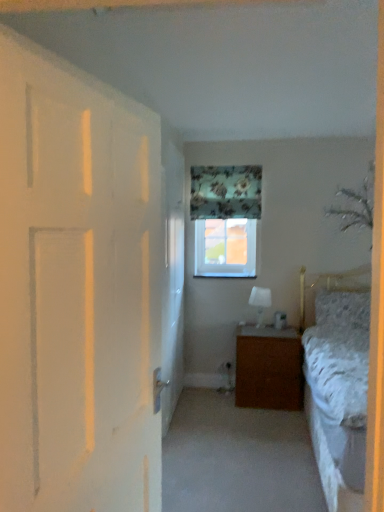
Question: Can you confirm if clear glass window at upper center is bigger than fluffy white pillow at right?

Choices:
 (A) yes
 (B) no

Answer: (B)

Question: Are clear glass window at upper center and fluffy white pillow at right located far from each other?

Choices:
 (A) yes
 (B) no

Answer: (B)

Question: Does clear glass window at upper center have a smaller size compared to fluffy white pillow at right?

Choices:
 (A) no
 (B) yes

Answer: (B)

Question: Is clear glass window at upper center not inside fluffy white pillow at right?

Choices:
 (A) yes
 (B) no

Answer: (A)

Question: Can you confirm if clear glass window at upper center is taller than fluffy white pillow at right?

Choices:
 (A) yes
 (B) no

Answer: (A)

Question: Relative to fluffy white pillow at right, is floral fabric curtain at upper center in front or behind?

Choices:
 (A) behind
 (B) front

Answer: (A)

Question: Considering the positions of floral fabric curtain at upper center and fluffy white pillow at right in the image, is floral fabric curtain at upper center bigger or smaller than fluffy white pillow at right?

Choices:
 (A) big
 (B) small

Answer: (B)

Question: Choose the correct answer: Is floral fabric curtain at upper center inside fluffy white pillow at right or outside it?

Choices:
 (A) inside
 (B) outside

Answer: (B)

Question: From their relative heights in the image, would you say floral fabric curtain at upper center is taller or shorter than fluffy white pillow at right?

Choices:
 (A) short
 (B) tall

Answer: (B)

Question: Considering the positions of white glossy screen door at center and fluffy white pillow at right in the image, is white glossy screen door at center taller or shorter than fluffy white pillow at right?

Choices:
 (A) tall
 (B) short

Answer: (A)

Question: From a real-world perspective, relative to fluffy white pillow at right, is white glossy screen door at center vertically above or below?

Choices:
 (A) below
 (B) above

Answer: (B)

Question: Do you think white glossy screen door at center is within fluffy white pillow at right, or outside of it?

Choices:
 (A) outside
 (B) inside

Answer: (A)

Question: Considering the positions of white glossy screen door at center and fluffy white pillow at right in the image, is white glossy screen door at center bigger or smaller than fluffy white pillow at right?

Choices:
 (A) small
 (B) big

Answer: (B)

Question: Which is correct: fluffy white pillow at right is inside clear glass window at upper center, or outside of it?

Choices:
 (A) outside
 (B) inside

Answer: (A)

Question: Considering the relative positions of fluffy white pillow at right and clear glass window at upper center in the image provided, is fluffy white pillow at right to the left or to the right of clear glass window at upper center?

Choices:
 (A) right
 (B) left

Answer: (A)